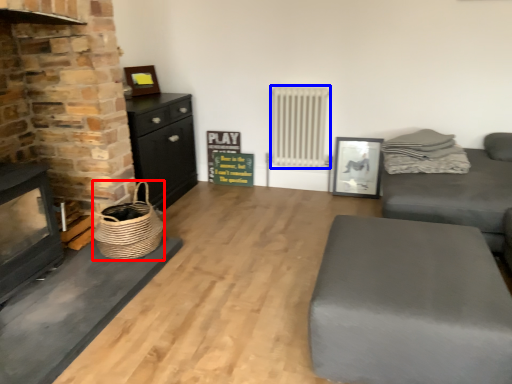
Question: Among these objects, which one is nearest to the camera, basket (highlighted by a red box) or radiator (highlighted by a blue box)?

Choices:
 (A) basket
 (B) radiator

Answer: (A)